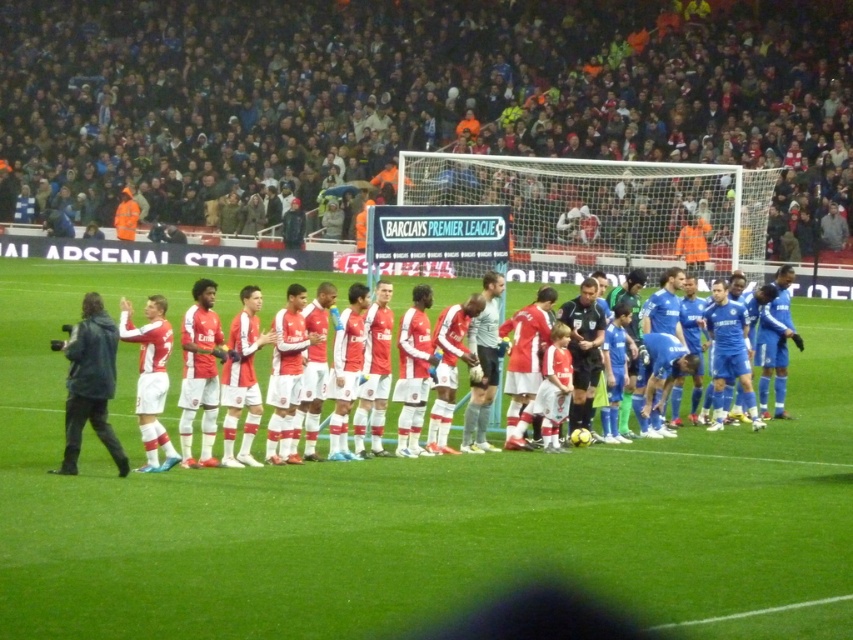
Is matte red jersey at center shorter than dark gray jacket at left?

Correct, matte red jersey at center is not as tall as dark gray jacket at left.

Who is shorter, matte red jersey at center or dark gray jacket at left?

Result: matte red jersey at center

Is point (209, 304) more distant than point (74, 429)?

Yes.

You are a GUI agent. You are given a task and a screenshot of the screen. Output one action in this format:
    pyautogui.click(x=<x>, y=<y>)
    Task: Click on the matte red jersey at center
    This screenshot has width=853, height=640.
    Given the screenshot: What is the action you would take?
    pyautogui.click(x=244, y=348)